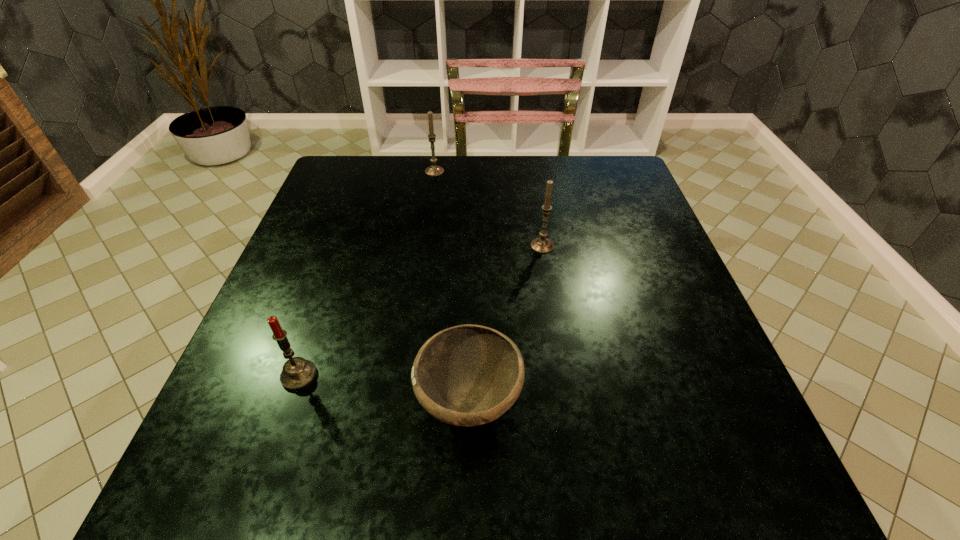
Find the location of a particular element. the farthest candle is located at coordinates (434, 170).

Where is `the farthest object`? This screenshot has width=960, height=540. the farthest object is located at coordinates (434, 170).

The height and width of the screenshot is (540, 960). I want to click on the rightmost candle, so click(540, 245).

At what (x,y) coordinates should I click in order to perform the action: click on the third nearest object. Please return your answer as a coordinate pair (x, y). The height and width of the screenshot is (540, 960). Looking at the image, I should click on (540, 245).

Find the location of `the nearest candle`. the nearest candle is located at coordinates (298, 373).

Locate an element on the screen. Image resolution: width=960 pixels, height=540 pixels. the leftmost object is located at coordinates (298, 373).

This screenshot has height=540, width=960. In order to click on the shortest object in this screenshot , I will do `click(467, 375)`.

Image resolution: width=960 pixels, height=540 pixels. Identify the location of free location located on the front of the second candle from left to right. (432, 188).

Find the location of a particular element. The width and height of the screenshot is (960, 540). blank space located on the left of the rightmost candle is located at coordinates (373, 246).

Find the location of a particular element. blank space located 0.180m on the back of the nearest candle is located at coordinates (329, 289).